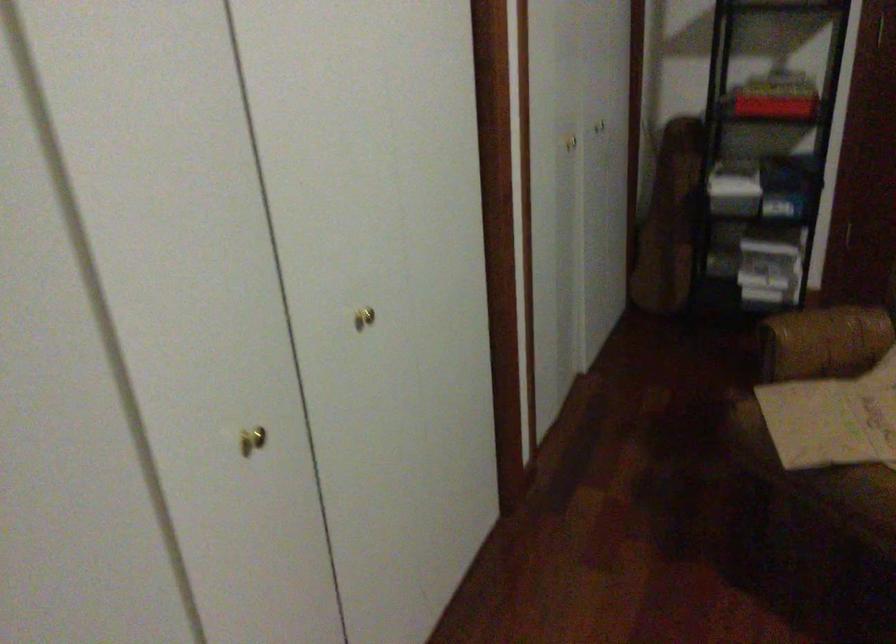
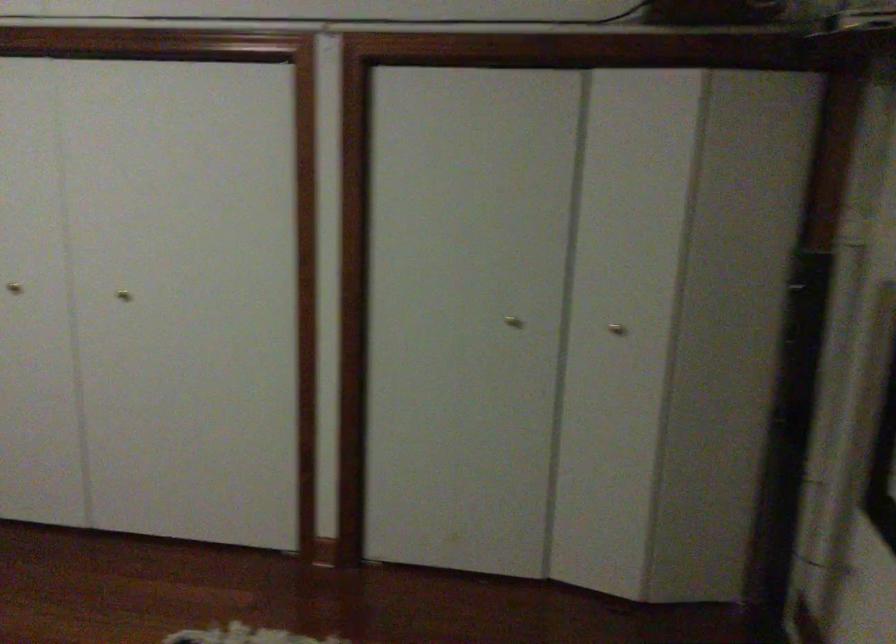
Question: The camera is either moving clockwise (left) or counter-clockwise (right) around the object. The first image is from the beginning of the video and the second image is from the end. Is the camera moving left or right when shooting the video?

Choices:
 (A) Left
 (B) Right

Answer: (A)